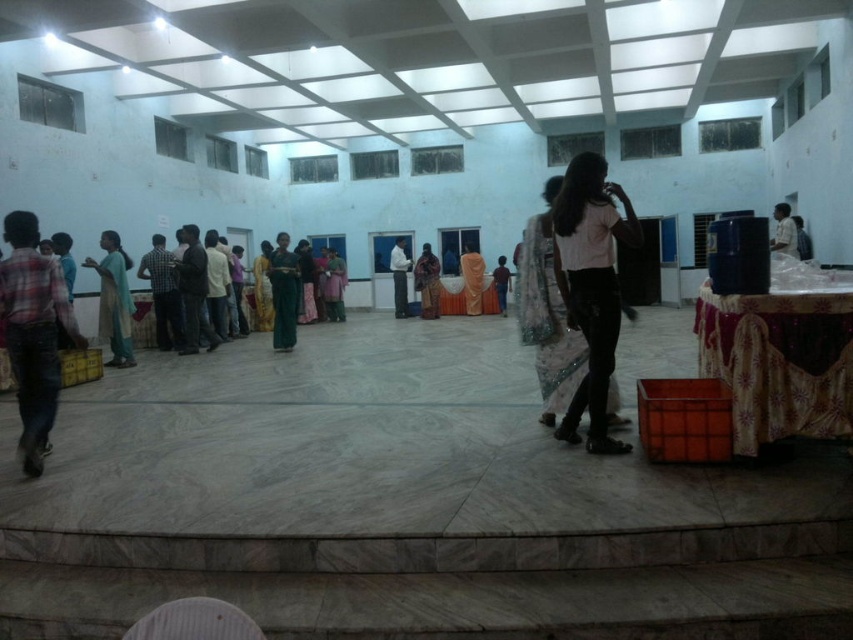
Does point (398, 310) come behind point (787, 220)?

Yes, point (398, 310) is farther from viewer.

Which is behind, point (393, 276) or point (791, 241)?

Point (393, 276)

Find the location of a particular element. white glossy shirt at center is located at coordinates (399, 276).

Is white lace saree at center positioned in front of dark blue shirt at center?

Yes.

Find the location of a particular element. white lace saree at center is located at coordinates (547, 314).

Identify the location of white lace saree at center. (547, 314).

Is point (541, 212) farther from camera compared to point (401, 236)?

No, it is not.

Identify the location of white lace saree at center. 547,314.

Is point (556, 310) farther from camera compared to point (402, 317)?

No, (556, 310) is closer to viewer.

Where is `white lace saree at center`? white lace saree at center is located at coordinates (547, 314).